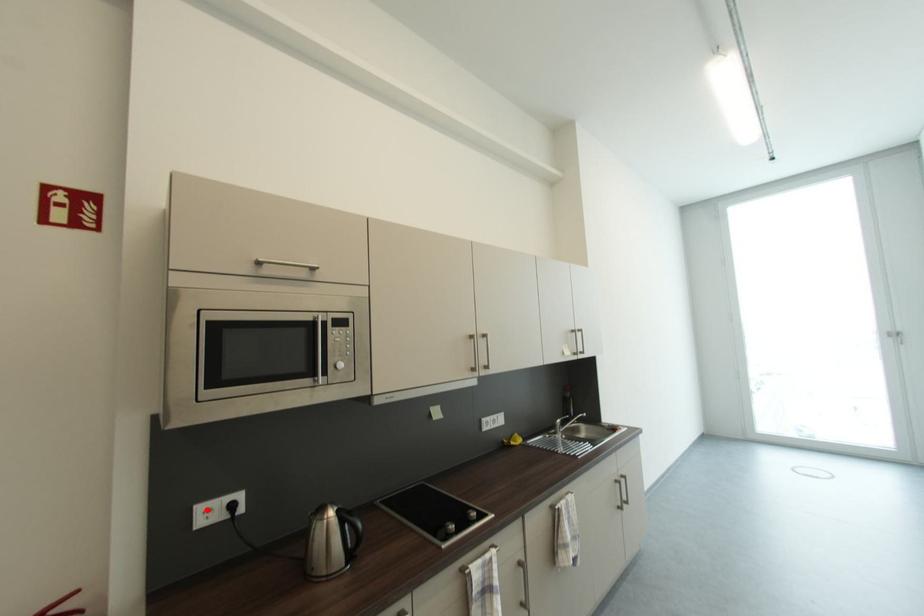
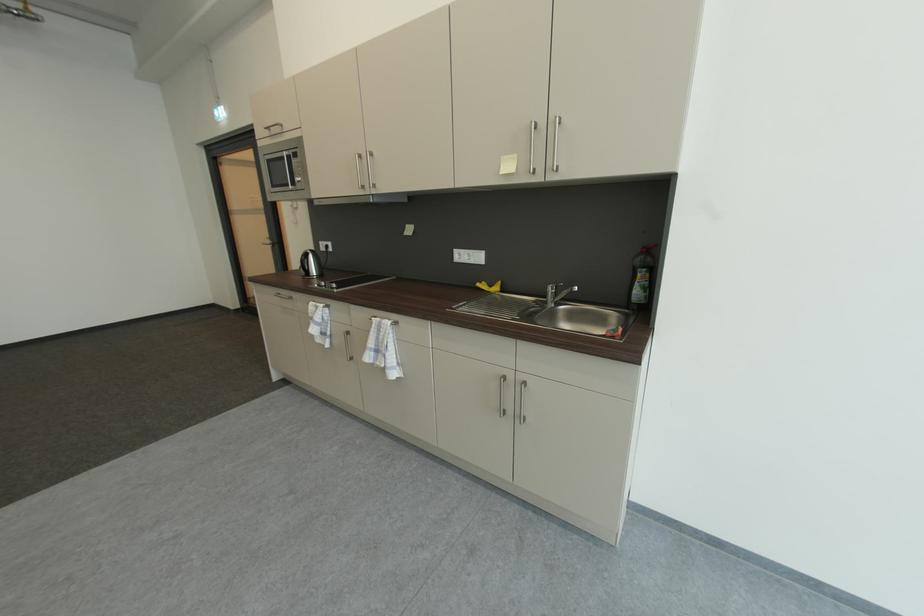
Locate, in the second image, the point that corresponds to the highlighted location in the first image.

(327, 245)